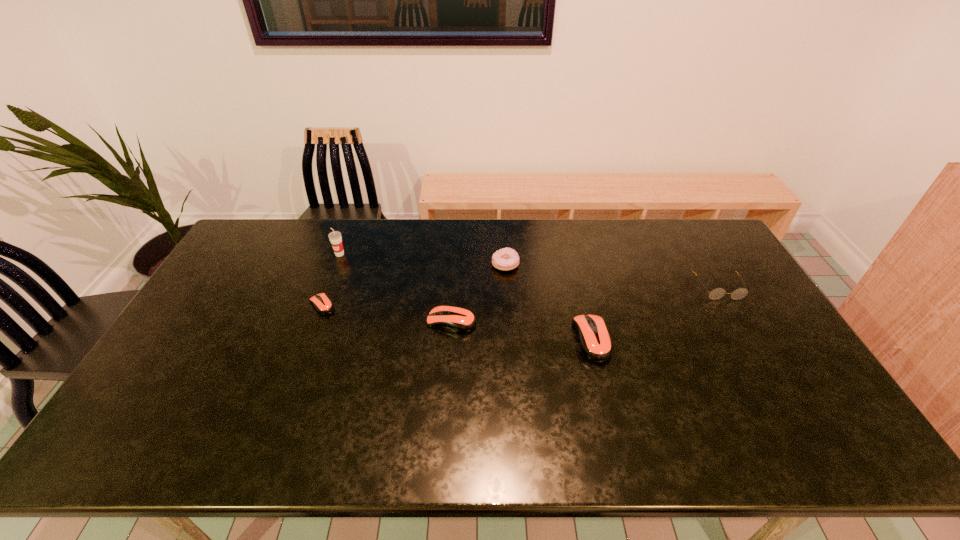
The width and height of the screenshot is (960, 540). In order to click on the leftmost computer mouse in this screenshot , I will do `click(323, 305)`.

Identify the location of the shortest computer mouse. This screenshot has height=540, width=960. (323, 305).

This screenshot has height=540, width=960. I want to click on the fifth tallest object, so click(459, 320).

I want to click on the second computer mouse from left to right, so click(x=459, y=320).

Locate an element on the screen. This screenshot has height=540, width=960. the fifth object from left to right is located at coordinates (595, 342).

The image size is (960, 540). I want to click on the fourth object from left to right, so click(505, 259).

Locate an element on the screen. the tallest object is located at coordinates (335, 237).

Where is `spectacles`? spectacles is located at coordinates (717, 293).

Where is `free space located on the left of the shortest object`? The height and width of the screenshot is (540, 960). free space located on the left of the shortest object is located at coordinates (234, 305).

In order to click on free point located 0.060m on the front of the second computer mouse from left to right in this screenshot , I will do (x=450, y=351).